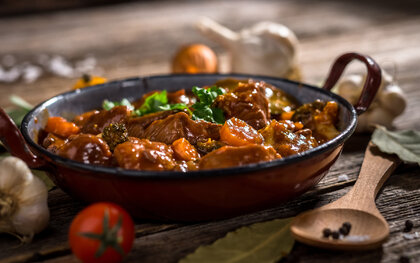
Identify the location of table. The image size is (420, 263). (414, 198).